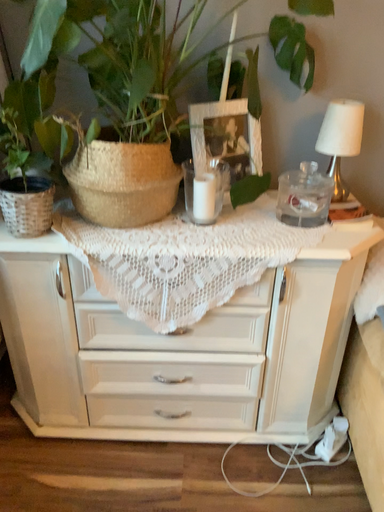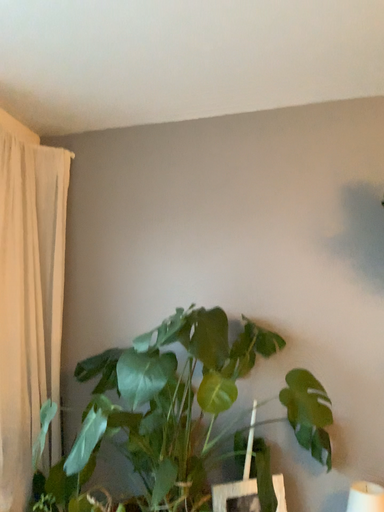
Question: How did the camera likely rotate when shooting the video?

Choices:
 (A) rotated right
 (B) rotated left

Answer: (B)